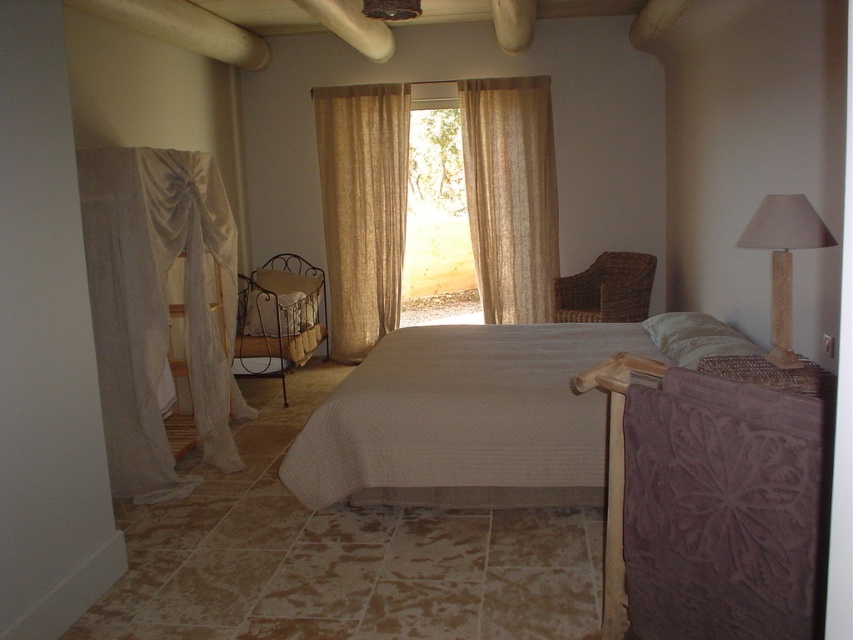
Between beige linen curtain at center and woven brown chair at center right, which one appears on the left side from the viewer's perspective?

Positioned to the left is beige linen curtain at center.

Is beige linen curtain at center shorter than woven brown chair at center right?

No, beige linen curtain at center is not shorter than woven brown chair at center right.

Does point (392, 316) lie behind point (589, 291)?

Yes, it is behind point (589, 291).

Find the location of a particular element. Image resolution: width=853 pixels, height=640 pixels. beige linen curtain at center is located at coordinates (363, 209).

Does beige quilted bed at center lie in front of beige textured curtain at center?

Yes, it is in front of beige textured curtain at center.

Can you confirm if beige quilted bed at center is smaller than beige textured curtain at center?

Actually, beige quilted bed at center might be larger than beige textured curtain at center.

Find the location of a particular element. beige quilted bed at center is located at coordinates (463, 419).

Locate an element on the screen. This screenshot has height=640, width=853. beige quilted bed at center is located at coordinates (463, 419).

Does beige quilted bed at center appear under metallic wrought iron cradle at center?

Yes, beige quilted bed at center is below metallic wrought iron cradle at center.

Which is below, beige quilted bed at center or metallic wrought iron cradle at center?

Positioned lower is beige quilted bed at center.

The width and height of the screenshot is (853, 640). What do you see at coordinates (463, 419) in the screenshot?
I see `beige quilted bed at center` at bounding box center [463, 419].

You are a GUI agent. You are given a task and a screenshot of the screen. Output one action in this format:
    pyautogui.click(x=<x>, y=<y>)
    Task: Click on the beige quilted bed at center
    This screenshot has height=640, width=853.
    Given the screenshot: What is the action you would take?
    pyautogui.click(x=463, y=419)